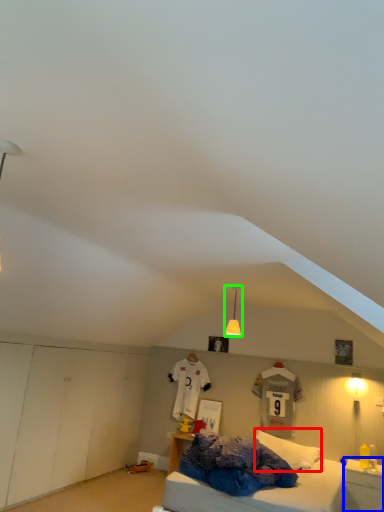
Question: Which object is positioned closest to pillow (highlighted by a red box)? Select from nightstand (highlighted by a blue box) and light fixture (highlighted by a green box).

Choices:
 (A) nightstand
 (B) light fixture

Answer: (A)